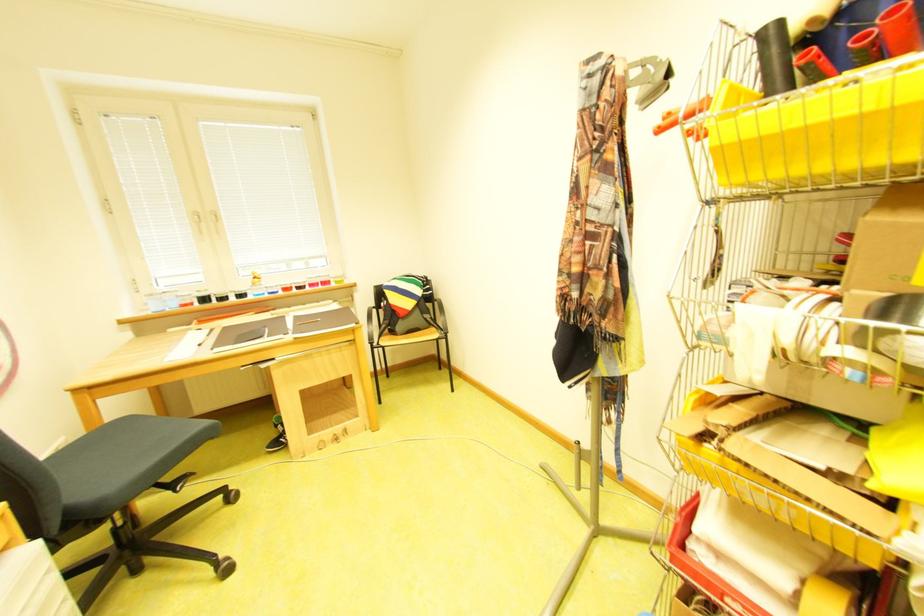
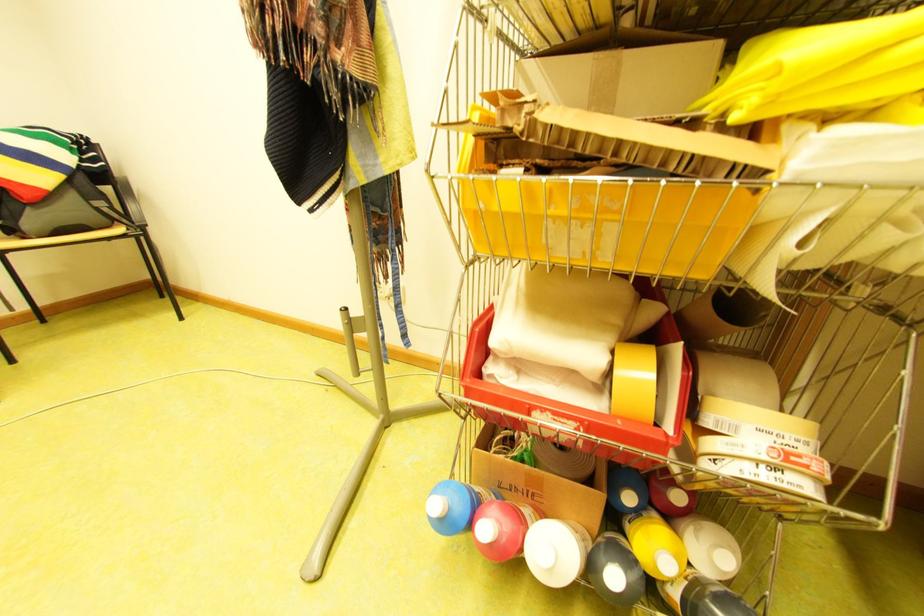
The point at (813, 576) is marked in the first image. Where is the corresponding point in the second image?

(622, 347)